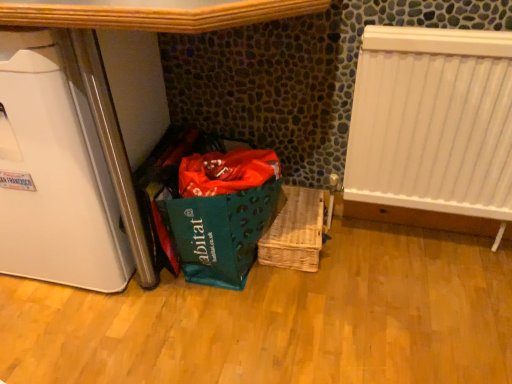
Question: Is woven wood basket at center in front of white plastic radiator at right?

Choices:
 (A) yes
 (B) no

Answer: (B)

Question: Does woven wood basket at center have a larger size compared to white plastic radiator at right?

Choices:
 (A) yes
 (B) no

Answer: (B)

Question: Is woven wood basket at center thinner than white plastic radiator at right?

Choices:
 (A) yes
 (B) no

Answer: (B)

Question: Is woven wood basket at center shorter than white plastic radiator at right?

Choices:
 (A) yes
 (B) no

Answer: (A)

Question: Could you tell me if woven wood basket at center is turned towards white plastic radiator at right?

Choices:
 (A) yes
 (B) no

Answer: (B)

Question: Looking at their shapes, would you say white glossy refrigerator at left is wider or thinner than woven wood basket at center?

Choices:
 (A) thin
 (B) wide

Answer: (B)

Question: In the image, is white glossy refrigerator at left on the left side or the right side of woven wood basket at center?

Choices:
 (A) left
 (B) right

Answer: (A)

Question: In terms of size, does white glossy refrigerator at left appear bigger or smaller than woven wood basket at center?

Choices:
 (A) big
 (B) small

Answer: (A)

Question: From a real-world perspective, is white glossy refrigerator at left positioned above or below woven wood basket at center?

Choices:
 (A) below
 (B) above

Answer: (B)

Question: From their relative heights in the image, would you say white glossy refrigerator at left is taller or shorter than white plastic radiator at right?

Choices:
 (A) tall
 (B) short

Answer: (A)

Question: From the image's perspective, is white glossy refrigerator at left above or below white plastic radiator at right?

Choices:
 (A) below
 (B) above

Answer: (B)

Question: Considering their positions, is white glossy refrigerator at left located in front of or behind white plastic radiator at right?

Choices:
 (A) front
 (B) behind

Answer: (A)

Question: From a real-world perspective, is white glossy refrigerator at left above or below white plastic radiator at right?

Choices:
 (A) above
 (B) below

Answer: (A)

Question: Based on their positions, is woven wood basket at center located to the left or right of white plastic radiator at right?

Choices:
 (A) left
 (B) right

Answer: (A)

Question: Is woven wood basket at center in front of or behind white plastic radiator at right in the image?

Choices:
 (A) behind
 (B) front

Answer: (A)